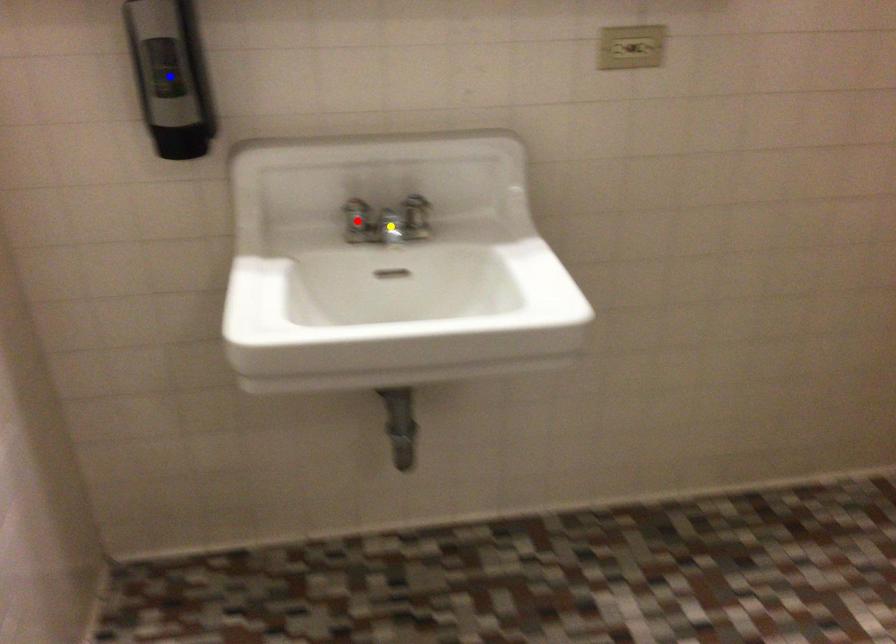
Order these from nearest to farthest:
A) red point
B) blue point
C) yellow point

red point → yellow point → blue point